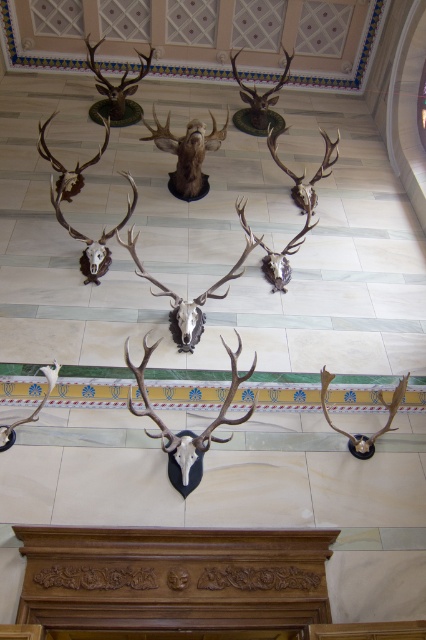
You are standing in front of the mounted deer heads display. You want to take a photo of the shiny silver antlers at center without getting too close. What is the minimum distance you should maintain from your current position to ensure you capture the entire antlers in the frame?

The shiny silver antlers at center are 4.73 meters away from the viewer. To capture the entire antlers in the frame without getting too close, you should maintain a minimum distance of 4.73 meters from your current position.

You are an interior designer assessing the wall decor. The brown matte deer head at center and the matte silver antlers at center are both mounted on the same wall. Which object has a greater height?

The matte silver antlers at center are taller than the brown matte deer head at center, so the matte silver antlers at center has a greater height.

You are an interior designer assessing the symmetry of the mounted deer heads. Which of the two antlers, the shiny brown antlers at center or the shiny silver antlers at center, is positioned to the left?

The shiny brown antlers at center are positioned to the left of the shiny silver antlers at center.